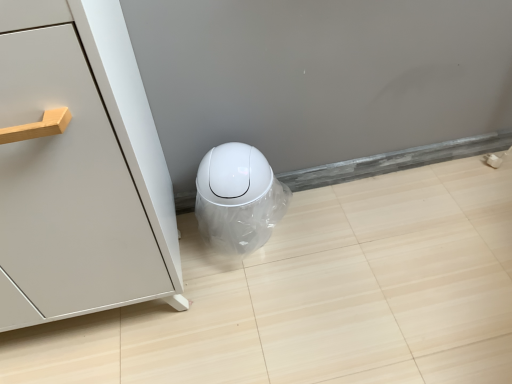
At what (x,y) coordinates should I click in order to perform the action: click on free space that is in between matte white cabinet at left and white glossy trash can at lower center. Please return your answer as a coordinate pair (x, y). The height and width of the screenshot is (384, 512). Looking at the image, I should click on (217, 268).